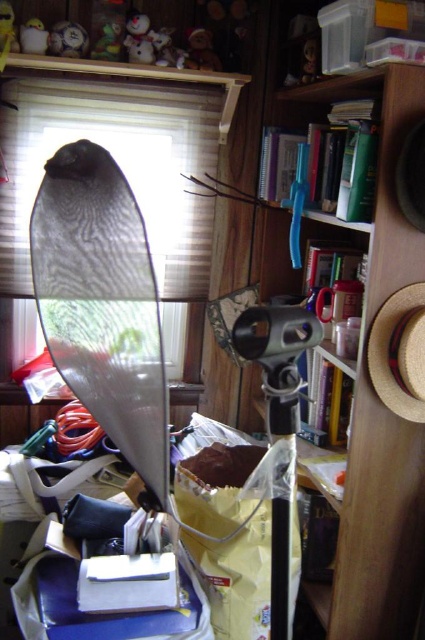
You are organizing a winter display and need to arrange two snowmen. The white glossy snowman at upper left and the wooden snowman at upper center are both part of the display. Which snowman should be placed lower to maintain the height order shown in the image?

The white glossy snowman at upper left should be placed lower because it is shorter than the wooden snowman at upper center, so placing it lower maintains the height order shown in the image.

Based on the photo, you are organizing a display in this workspace and need to place both the white plush toy at upper left and the white glossy snowman at upper left on a shelf that can only hold items up to 30 cm in width. Which item should you choose to fit within the shelf width limit?

The white glossy snowman at upper left should be chosen because its width is smaller than the white plush toy at upper left, ensuring it fits within the 30 cm shelf width limit.

You are organizing items on a shelf and see the white plush toy at upper left and the wooden snowman at upper center. Which item is positioned higher on the shelf?

The white plush toy at upper left is positioned higher on the shelf than the wooden snowman at upper center.